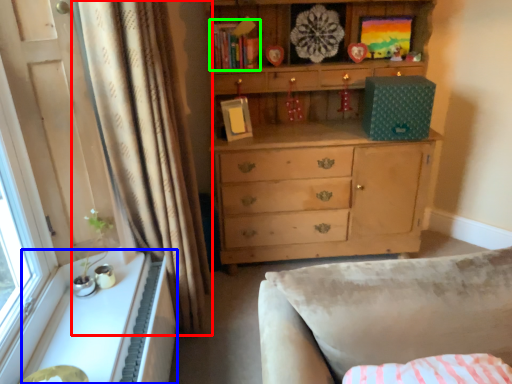
Question: Which object is positioned farthest from curtain (highlighted by a red box)? Select from cabinetry (highlighted by a blue box) and book (highlighted by a green box).

Choices:
 (A) cabinetry
 (B) book

Answer: (B)